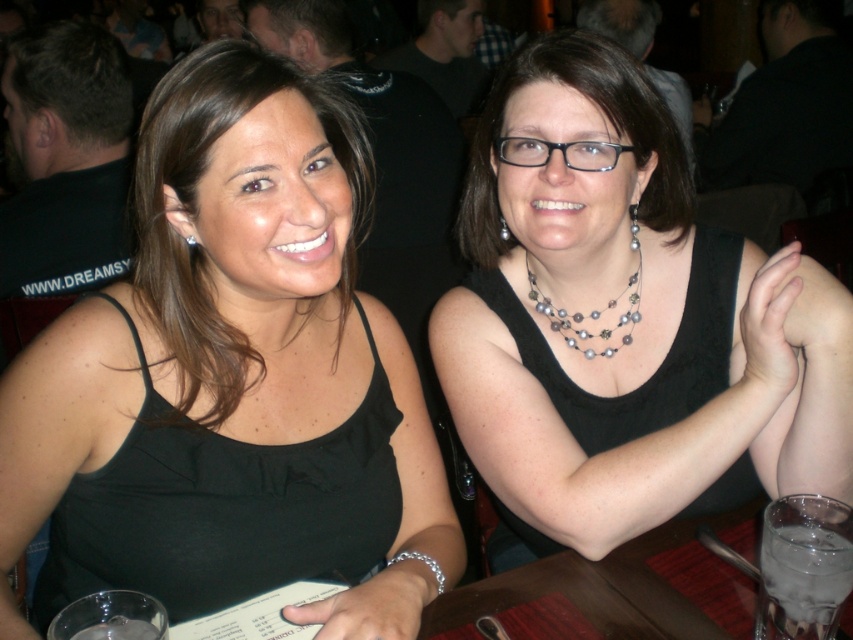
You are an interior designer planning to place a decorative item in a room. The room has a sofa at the center. You have a small statue that is 0.2 meters wide. Can the statue be placed at the position of the black matte tank top at center without overlapping with the sofa?

The position of black matte tank top at center is at point (231, 380). Since the sofa is at the center, the statue can be placed there as there is no overlap.